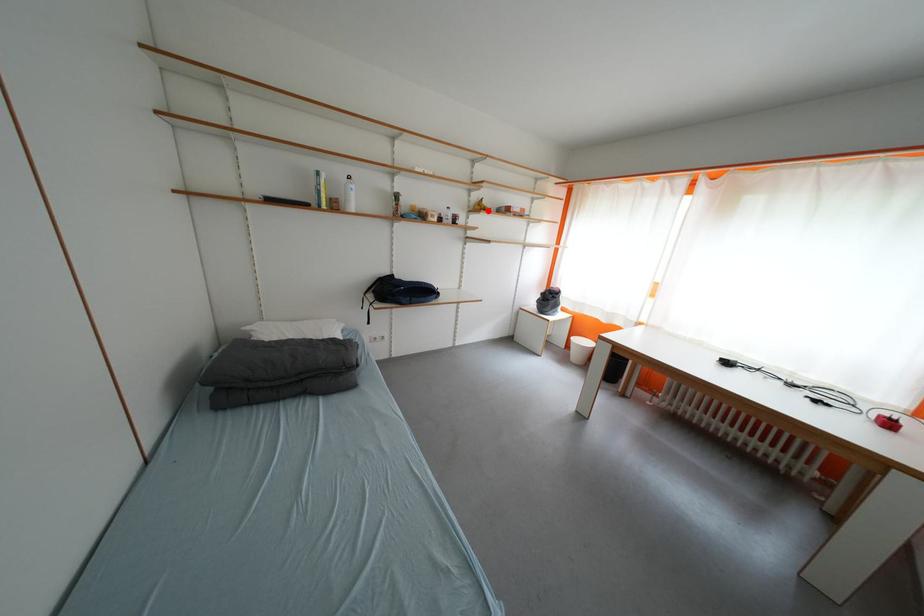
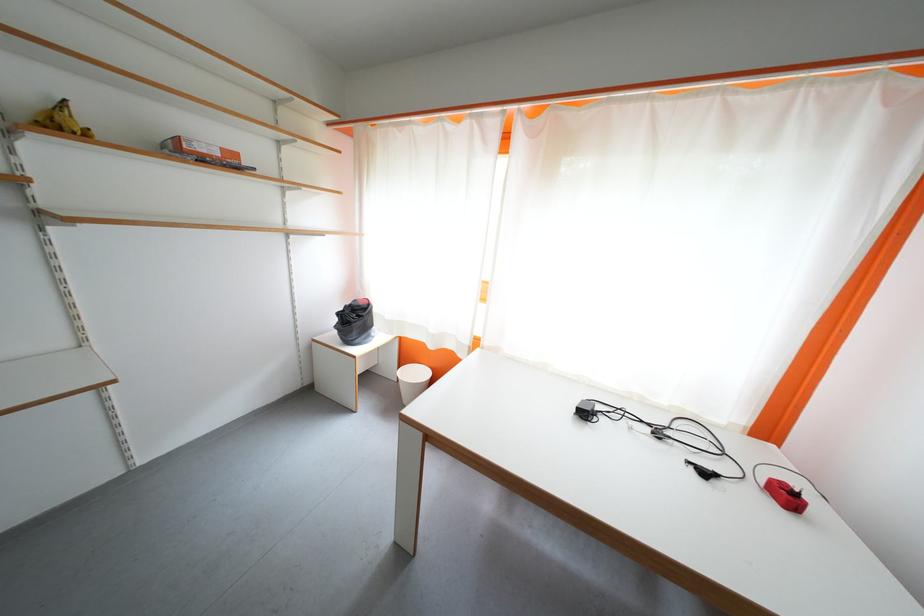
Where in the second image is the point corresponding to the highlighted location from the first image?

(68, 129)